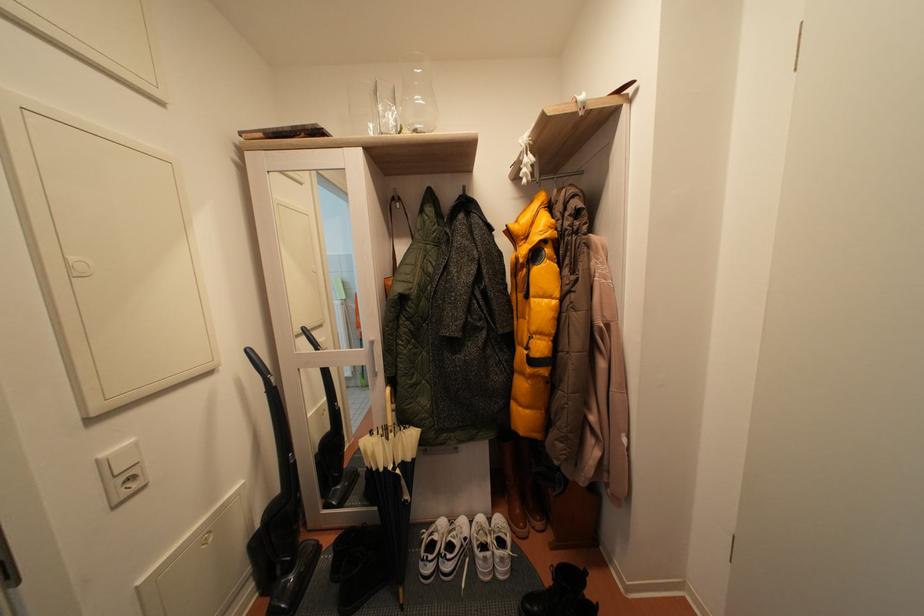
Image resolution: width=924 pixels, height=616 pixels. Find the location of `glass carafe`. glass carafe is located at coordinates 417,94.